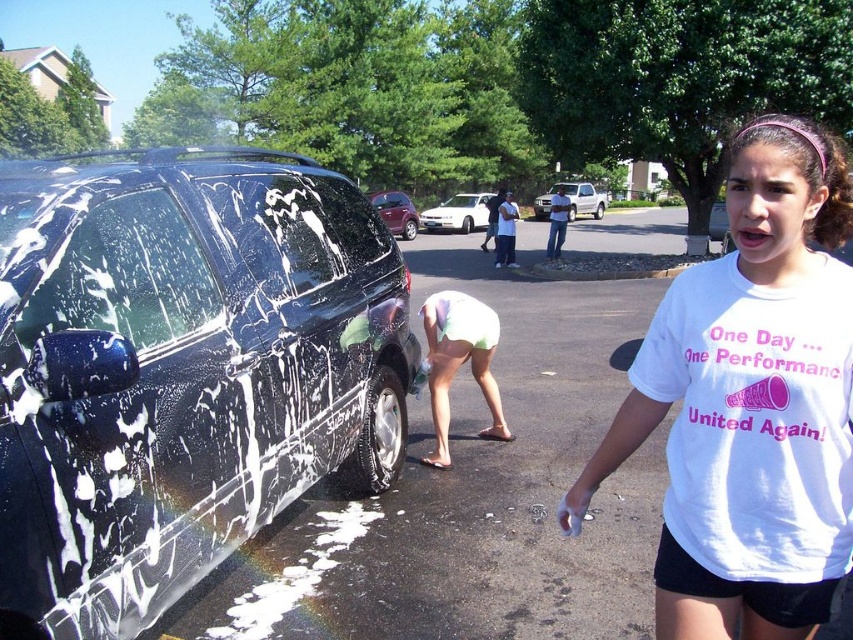
Question: Which of the following is the closest to the observer?

Choices:
 (A) light green shorts at lower center
 (B) shiny red car at center

Answer: (A)

Question: Which object is the closest to the white cotton t-shirt at center?

Choices:
 (A) light green shorts at lower center
 (B) shiny black suv at left
 (C) white matte truck at center
 (D) white glossy car at center

Answer: (B)

Question: Is shiny black suv at left to the left of shiny red car at center from the viewer's perspective?

Choices:
 (A) no
 (B) yes

Answer: (A)

Question: From the image, what is the correct spatial relationship of white glossy car at center in relation to shiny red car at center?

Choices:
 (A) right
 (B) left

Answer: (A)

Question: Is light green shorts at lower center above shiny red car at center?

Choices:
 (A) no
 (B) yes

Answer: (A)

Question: Estimate the real-world distances between objects in this image. Which object is farther from the shiny black suv at left?

Choices:
 (A) shiny red car at center
 (B) white cotton t-shirt at center
 (C) white matte truck at center
 (D) light green shorts at lower center

Answer: (A)